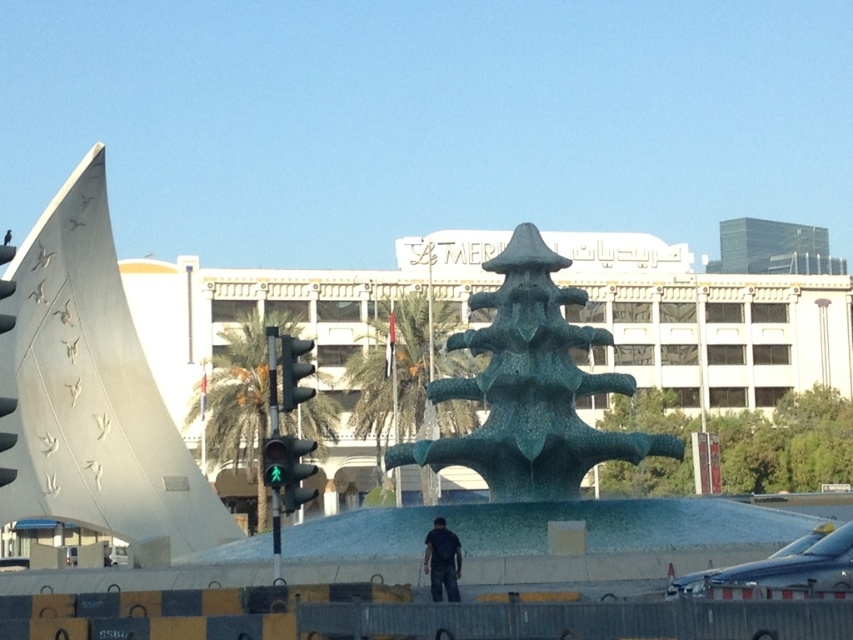
You are standing at the fountain and looking towards the Le Meridien building. There are two points marked in the scene. The first point is at coordinate point (442, 547) and the second point is at coordinate point (291, 337). Which of these points is closer to you?

Point (442, 547) is in front of point (291, 337), so it is closer to you.

You are a city planner who needs to install a new bench between the green textured fountain at center and the green matte traffic light at center. The bench requires 2 meters of space to be placed comfortably. Is there enough space between them to accommodate the bench?

The green textured fountain at center and the green matte traffic light at center are 13.23 meters apart from each other. Since the bench requires 2 meters of space, there is more than enough space to place it comfortably between them.